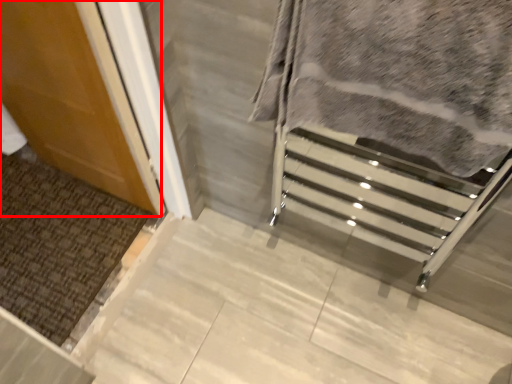
Question: From the image, what is the correct spatial relationship of door (annotated by the red box) in relation to blanket?

Choices:
 (A) left
 (B) right

Answer: (A)